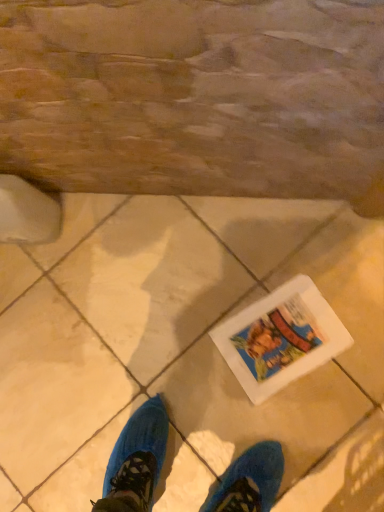
Find the location of a particular element. vacant space to the right of white matte comic book at lower center is located at coordinates (344, 271).